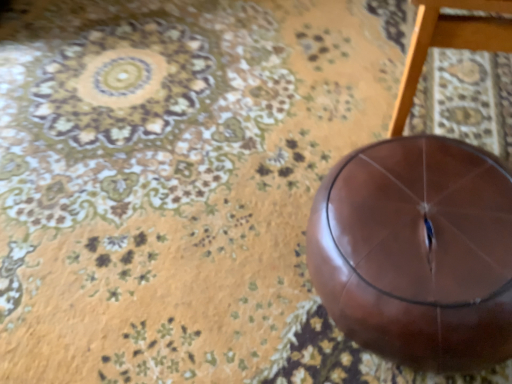
Question: Does glossy leather ball at center appear on the left side of glossy brown stool at center?

Choices:
 (A) yes
 (B) no

Answer: (A)

Question: Would you say glossy leather ball at center contains glossy brown stool at center?

Choices:
 (A) yes
 (B) no

Answer: (B)

Question: Is glossy leather ball at center positioned in front of glossy brown stool at center?

Choices:
 (A) yes
 (B) no

Answer: (B)

Question: Is glossy leather ball at center shorter than glossy brown stool at center?

Choices:
 (A) yes
 (B) no

Answer: (A)

Question: From a real-world perspective, is glossy leather ball at center located higher than glossy brown stool at center?

Choices:
 (A) yes
 (B) no

Answer: (B)

Question: Is glossy leather ball at center oriented away from glossy brown stool at center?

Choices:
 (A) no
 (B) yes

Answer: (A)

Question: Is the depth of glossy brown stool at center greater than that of glossy leather ball at center?

Choices:
 (A) yes
 (B) no

Answer: (B)

Question: From a real-world perspective, is glossy brown stool at center located higher than glossy leather ball at center?

Choices:
 (A) no
 (B) yes

Answer: (B)

Question: Is glossy brown stool at center outside glossy leather ball at center?

Choices:
 (A) no
 (B) yes

Answer: (B)

Question: Is glossy brown stool at center facing towards glossy leather ball at center?

Choices:
 (A) no
 (B) yes

Answer: (A)

Question: From a real-world perspective, is glossy brown stool at center beneath glossy leather ball at center?

Choices:
 (A) yes
 (B) no

Answer: (B)

Question: Can you confirm if glossy brown stool at center is smaller than glossy leather ball at center?

Choices:
 (A) no
 (B) yes

Answer: (A)

Question: Considering the positions of glossy leather ball at center and glossy brown stool at center in the image, is glossy leather ball at center taller or shorter than glossy brown stool at center?

Choices:
 (A) tall
 (B) short

Answer: (B)